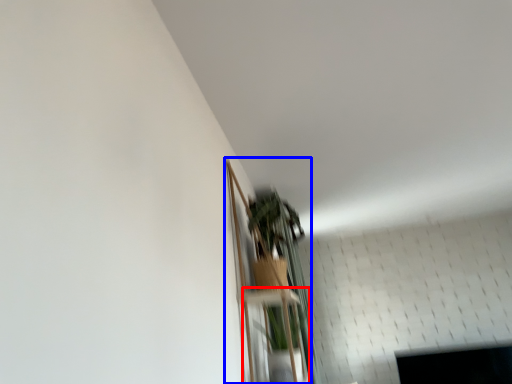
Question: Which point is closer to the camera, shelf (highlighted by a red box) or shelf (highlighted by a blue box)?

Choices:
 (A) shelf
 (B) shelf

Answer: (B)